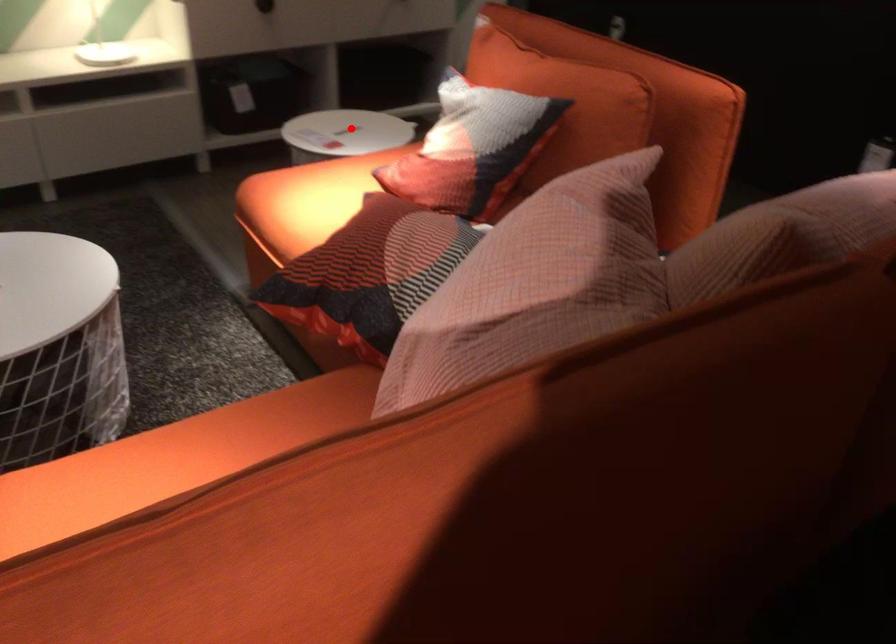
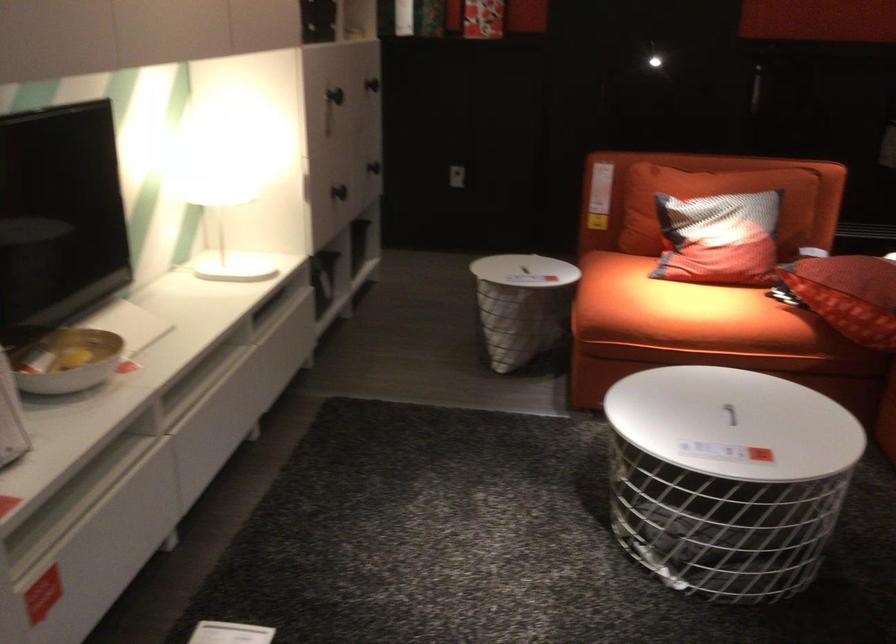
Find the pixel in the second image that matches the highlighted location in the first image.

(522, 270)